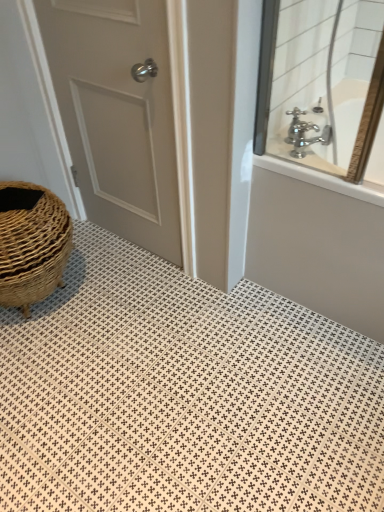
This screenshot has height=512, width=384. I want to click on blank space situated above white textured tile at lower left (from a real-world perspective), so click(x=128, y=338).